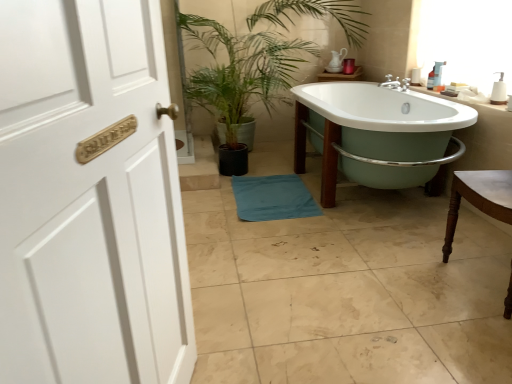
Question: Choose the correct answer: Is blue fabric bath towel at center inside green glossy plant at center or outside it?

Choices:
 (A) outside
 (B) inside

Answer: (A)

Question: From a real-world perspective, relative to green glossy plant at center, is blue fabric bath towel at center vertically above or below?

Choices:
 (A) below
 (B) above

Answer: (A)

Question: Which object is the closest to the brown wooden chair at right?

Choices:
 (A) white ceramic sink at upper right
 (B) green glossy plant at center
 (C) white porcelain bathtub at center
 (D) blue fabric bath towel at center

Answer: (A)

Question: Considering the real-world distances, which object is farthest from the brown wooden chair at right?

Choices:
 (A) blue fabric bath towel at center
 (B) green glossy plant at center
 (C) white porcelain bathtub at center
 (D) white ceramic sink at upper right

Answer: (B)